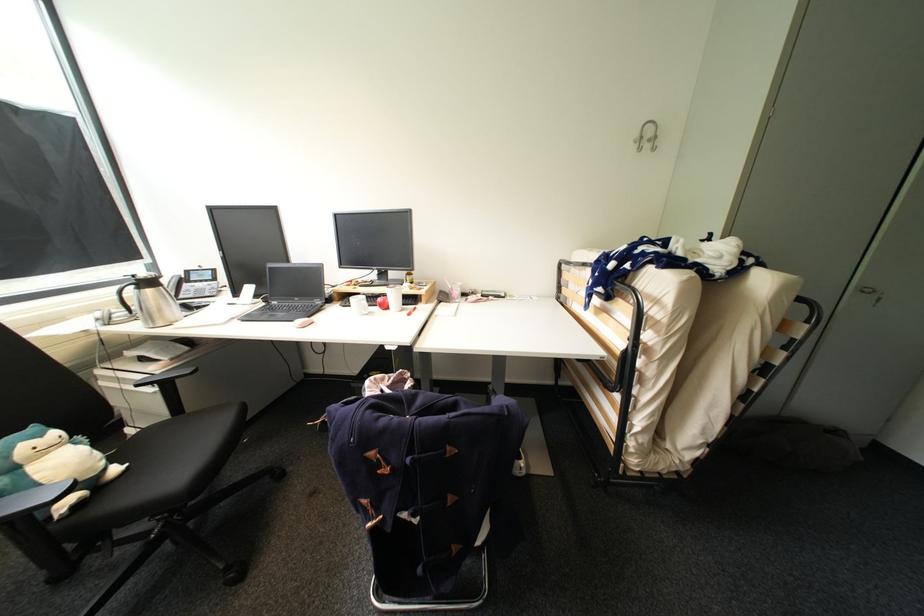
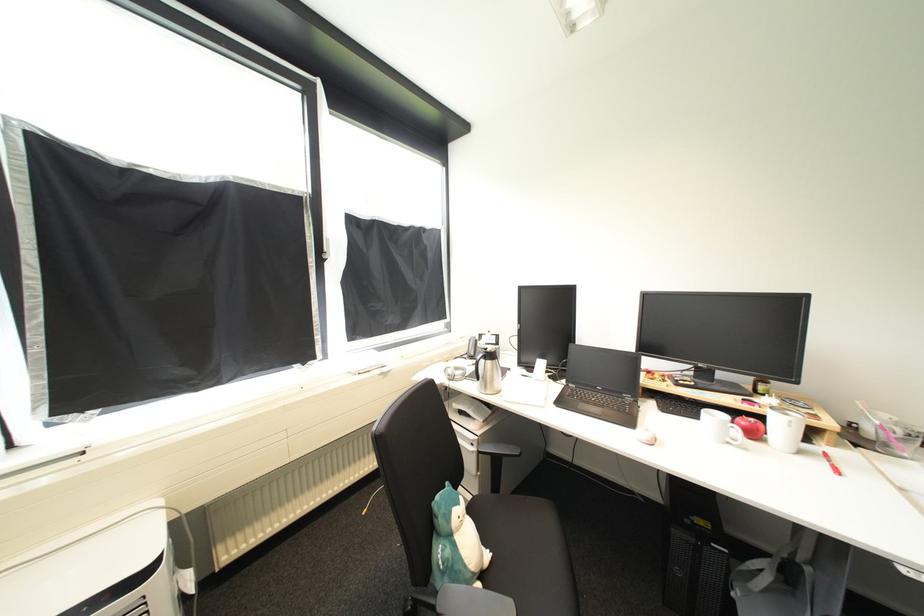
Locate, in the second image, the point that corresponds to (162,392) in the first image.

(480, 453)